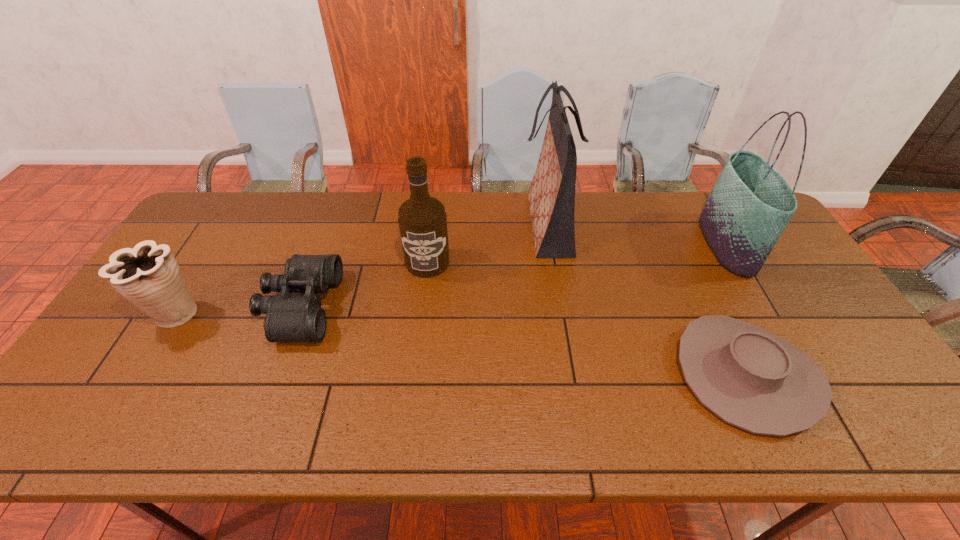
I want to click on shopping bag, so click(x=551, y=196).

Find the location of `tote bag`. tote bag is located at coordinates (750, 204).

At what (x,y) coordinates should I click in order to perform the action: click on the third object from left to right. Please return your answer as a coordinate pair (x, y). The width and height of the screenshot is (960, 540). Looking at the image, I should click on (422, 219).

Where is `alcohol`? This screenshot has height=540, width=960. alcohol is located at coordinates (422, 219).

This screenshot has width=960, height=540. Identify the location of urn. tap(148, 275).

I want to click on the fourth tallest object, so click(x=148, y=275).

In order to click on the fifth tallest object in this screenshot , I will do `click(289, 318)`.

I want to click on binoculars, so click(289, 318).

At what (x,y) coordinates should I click in order to perform the action: click on the shortest object. Please return your answer as a coordinate pair (x, y). Looking at the image, I should click on (750, 378).

The width and height of the screenshot is (960, 540). Find the location of `free space located on the front-facing side of the shopping bag`. free space located on the front-facing side of the shopping bag is located at coordinates (430, 224).